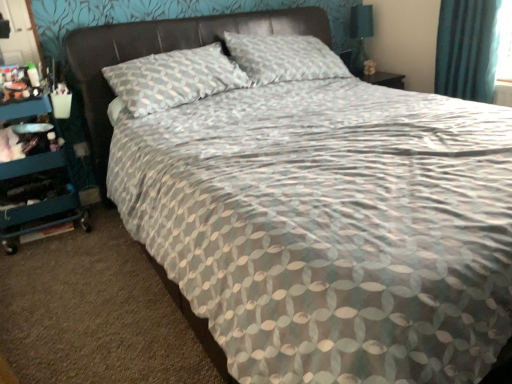
Question: Does teal plastic dresser at left have a lesser width compared to leather-like headboard at upper center?

Choices:
 (A) yes
 (B) no

Answer: (A)

Question: Is there a large distance between teal plastic dresser at left and leather-like headboard at upper center?

Choices:
 (A) no
 (B) yes

Answer: (A)

Question: Considering the relative positions of teal plastic dresser at left and leather-like headboard at upper center in the image provided, is teal plastic dresser at left to the left of leather-like headboard at upper center from the viewer's perspective?

Choices:
 (A) no
 (B) yes

Answer: (B)

Question: Is teal plastic dresser at left smaller than leather-like headboard at upper center?

Choices:
 (A) yes
 (B) no

Answer: (A)

Question: Is teal plastic dresser at left shorter than leather-like headboard at upper center?

Choices:
 (A) no
 (B) yes

Answer: (A)

Question: Relative to leather-like headboard at upper center, is teal plastic dresser at left in front or behind?

Choices:
 (A) front
 (B) behind

Answer: (B)

Question: Considering the relative positions of teal plastic dresser at left and leather-like headboard at upper center in the image provided, is teal plastic dresser at left to the left or to the right of leather-like headboard at upper center?

Choices:
 (A) left
 (B) right

Answer: (A)

Question: Choose the correct answer: Is teal plastic dresser at left inside leather-like headboard at upper center or outside it?

Choices:
 (A) inside
 (B) outside

Answer: (B)

Question: Considering the positions of point (x=65, y=162) and point (x=122, y=56), is point (x=65, y=162) closer or farther from the camera than point (x=122, y=56)?

Choices:
 (A) farther
 (B) closer

Answer: (A)

Question: In terms of size, does matte black table lamp at upper right appear bigger or smaller than leather-like headboard at upper center?

Choices:
 (A) big
 (B) small

Answer: (B)

Question: Relative to leather-like headboard at upper center, is matte black table lamp at upper right in front or behind?

Choices:
 (A) behind
 (B) front

Answer: (A)

Question: Considering the relative positions of matte black table lamp at upper right and leather-like headboard at upper center in the image provided, is matte black table lamp at upper right to the left or to the right of leather-like headboard at upper center?

Choices:
 (A) left
 (B) right

Answer: (B)

Question: Which is correct: matte black table lamp at upper right is inside leather-like headboard at upper center, or outside of it?

Choices:
 (A) outside
 (B) inside

Answer: (A)

Question: Is leather-like headboard at upper center taller or shorter than teal plastic dresser at left?

Choices:
 (A) short
 (B) tall

Answer: (A)

Question: From a real-world perspective, is leather-like headboard at upper center positioned above or below teal plastic dresser at left?

Choices:
 (A) above
 (B) below

Answer: (A)